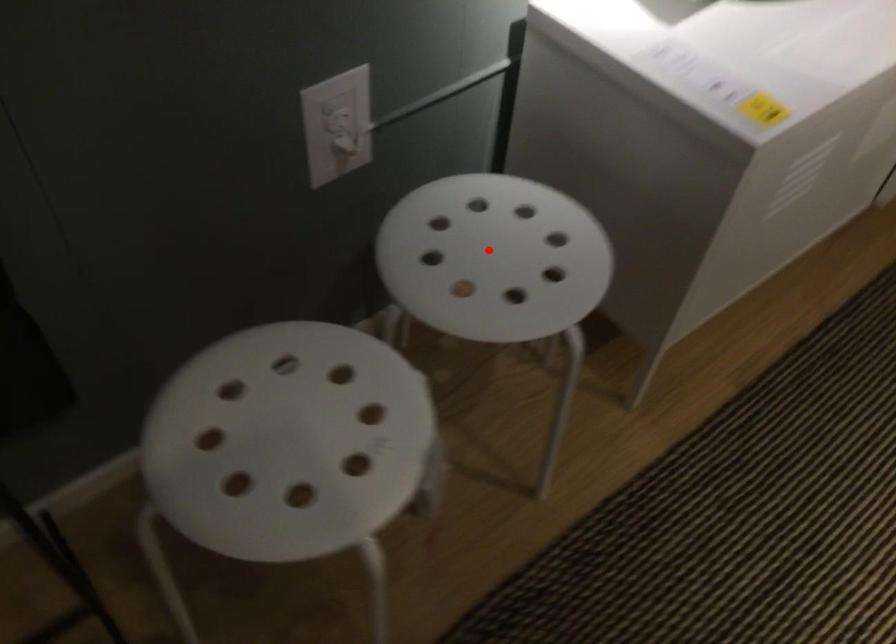
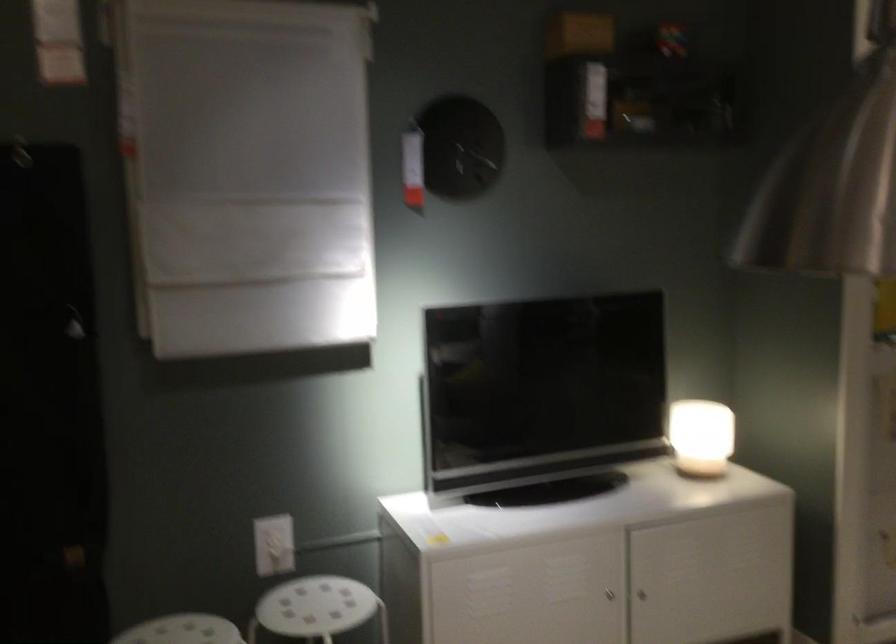
Locate, in the second image, the point that corresponds to the highlighted location in the first image.

(315, 607)